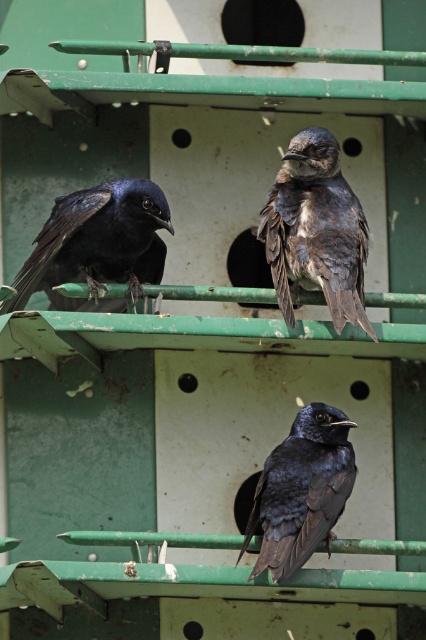
Question: Among these points, which one is nearest to the camera?

Choices:
 (A) click(284, 269)
 (B) click(273, 472)

Answer: (B)

Question: Can you confirm if matte black bird at upper left is positioned below shiny black bird at center?

Choices:
 (A) no
 (B) yes

Answer: (A)

Question: Which of these objects is positioned closest to the shiny black bird at center?

Choices:
 (A) matte black bird at upper left
 (B) shiny dark blue bird at center

Answer: (B)

Question: Which of the following is the farthest from the observer?

Choices:
 (A) matte black bird at upper left
 (B) shiny dark blue bird at center

Answer: (A)

Question: Can you confirm if matte black bird at upper left is bigger than shiny black bird at center?

Choices:
 (A) no
 (B) yes

Answer: (B)

Question: Can you confirm if shiny dark blue bird at center is positioned above matte black bird at upper left?

Choices:
 (A) yes
 (B) no

Answer: (A)